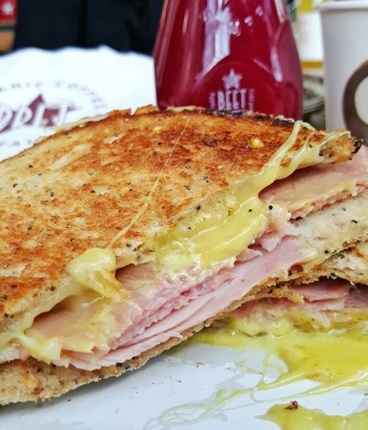
Find the location of a particular element. The image size is (368, 430). logo on cup is located at coordinates (350, 93).